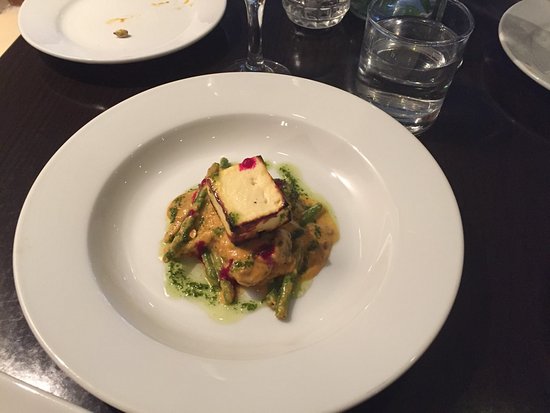
This screenshot has height=413, width=550. I want to click on black table, so click(x=513, y=212).